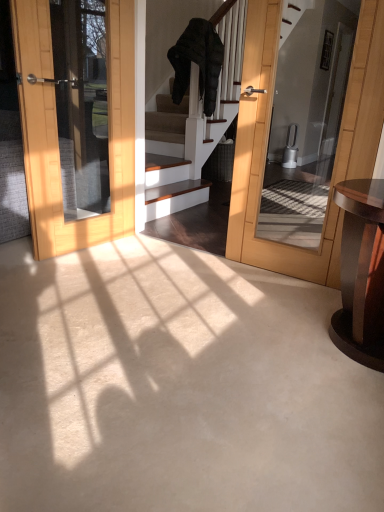
Question: Should I look upward or downward to see dark wood table at right?

Choices:
 (A) down
 (B) up

Answer: (A)

Question: Does dark gray puffer jacket at center come behind dark wood table at right?

Choices:
 (A) no
 (B) yes

Answer: (B)

Question: Can you confirm if dark gray puffer jacket at center is thinner than dark wood table at right?

Choices:
 (A) no
 (B) yes

Answer: (B)

Question: From a real-world perspective, is dark gray puffer jacket at center on top of dark wood table at right?

Choices:
 (A) no
 (B) yes

Answer: (B)

Question: From the image's perspective, is dark gray puffer jacket at center above dark wood table at right?

Choices:
 (A) no
 (B) yes

Answer: (B)

Question: Can you confirm if dark gray puffer jacket at center is smaller than dark wood table at right?

Choices:
 (A) yes
 (B) no

Answer: (B)

Question: Is dark gray puffer jacket at center positioned in front of dark wood table at right?

Choices:
 (A) no
 (B) yes

Answer: (A)

Question: Is dark wood table at right to the right of dark gray puffer jacket at center from the viewer's perspective?

Choices:
 (A) no
 (B) yes

Answer: (B)

Question: Does dark wood table at right have a lesser width compared to dark gray puffer jacket at center?

Choices:
 (A) yes
 (B) no

Answer: (B)

Question: Is dark wood table at right not near dark gray puffer jacket at center?

Choices:
 (A) no
 (B) yes

Answer: (B)

Question: Can you confirm if dark wood table at right is smaller than dark gray puffer jacket at center?

Choices:
 (A) yes
 (B) no

Answer: (A)

Question: From a real-world perspective, is dark wood table at right below dark gray puffer jacket at center?

Choices:
 (A) yes
 (B) no

Answer: (A)

Question: Is dark wood table at right further to camera compared to dark gray puffer jacket at center?

Choices:
 (A) no
 (B) yes

Answer: (A)

Question: From the image's perspective, is dark wood table at right located above or below dark gray puffer jacket at center?

Choices:
 (A) below
 (B) above

Answer: (A)